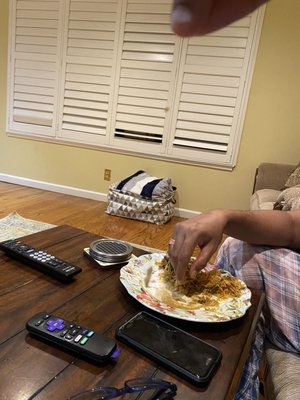
Find the location of `table`. table is located at coordinates pyautogui.click(x=96, y=302).